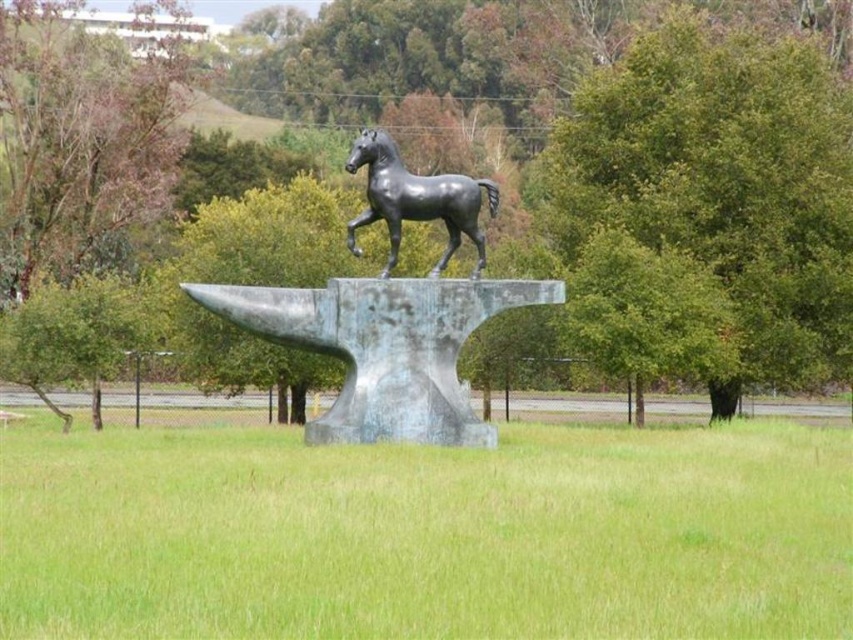
You are standing at the point marked by the coordinates [427,534] in the image. What is the immediate surface you are standing on?

The immediate surface you are standing on is green grass at center, as indicated by the point coordinates provided.